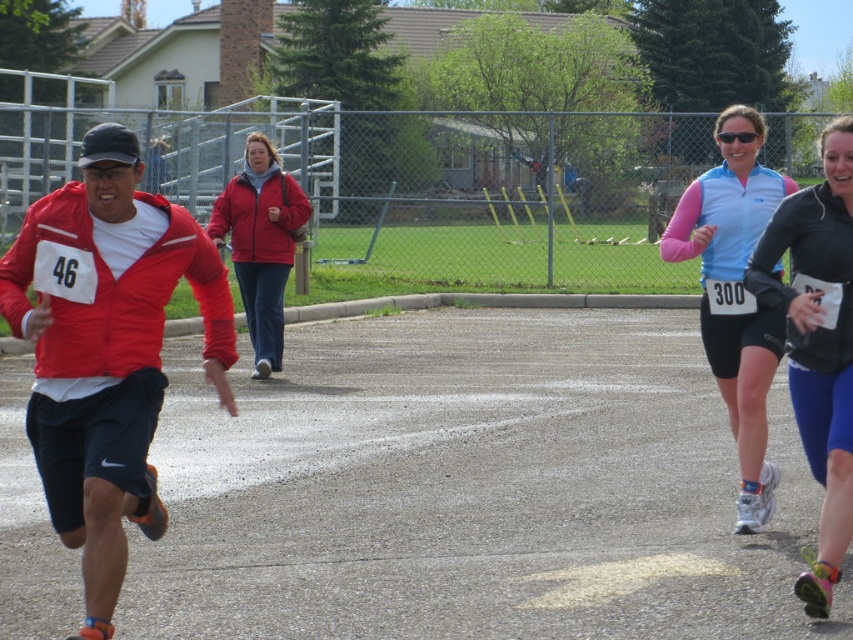
You are a photographer positioned at the starting line of the running event. You want to capture a photo that includes both the point at (685, 253) and the point at (735, 138). Which point should you focus on first to ensure both are in focus?

You should focus on point (735, 138) first because it is closer to you than point (685, 253). By focusing on the closer point, the further point will also be within the depth of field, ensuring both are in focus.

You are a photographer trying to capture a closeup shot of the matte red jacket at left and the black matte running shoe at right. If your camera can only focus on objects wider than 10 cm, will both objects be in focus?

The matte red jacket at left is wider than the black matte running shoe at right, but since the description only states their relative sizes and not their exact measurements, we cannot confirm if both are wider than 10 cm. The camera might focus on the wider jacket but may struggle with the narrower shoe.

You are a photographer at the running event. You want to take a photo that includes both the matte red jacket at left and the black matte running shoe at right. Based on their positions, which object should appear lower in the photo?

The matte red jacket at left is positioned under the black matte running shoe at right, so in the photo, the matte red jacket at left will appear lower than the black matte running shoe at right.